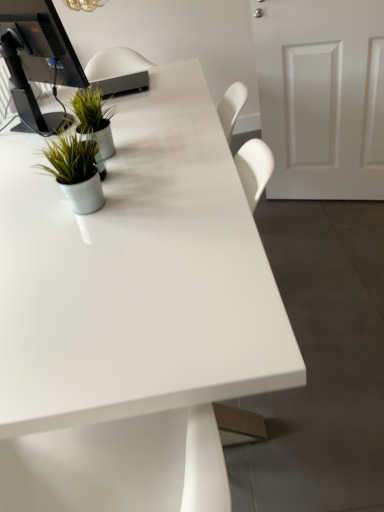
Question: Choose the correct answer: Is white glossy desk at center inside green matte plant at upper left, which is the 1th houseplant in back-to-front order, or outside it?

Choices:
 (A) inside
 (B) outside

Answer: (B)

Question: Looking at the image, does white glossy desk at center seem bigger or smaller compared to green matte plant at upper left, which is the 2th houseplant in bottom-to-top order?

Choices:
 (A) small
 (B) big

Answer: (B)

Question: Which is nearer to the green matte plant at upper left, arranged as the 1th houseplant when viewed from the top?

Choices:
 (A) white matte door at right
 (B) metallic silver pot at left, marked as the first houseplant in a front-to-back arrangement
 (C) black glossy monitor at upper left
 (D) white glossy desk at center

Answer: (B)

Question: Considering the real-world distances, which object is closest to the black glossy monitor at upper left?

Choices:
 (A) white matte door at right
 (B) metallic silver pot at left, the 2th houseplant in the top-to-bottom sequence
 (C) green matte plant at upper left, which is the 1th houseplant in back-to-front order
 (D) white glossy desk at center

Answer: (C)